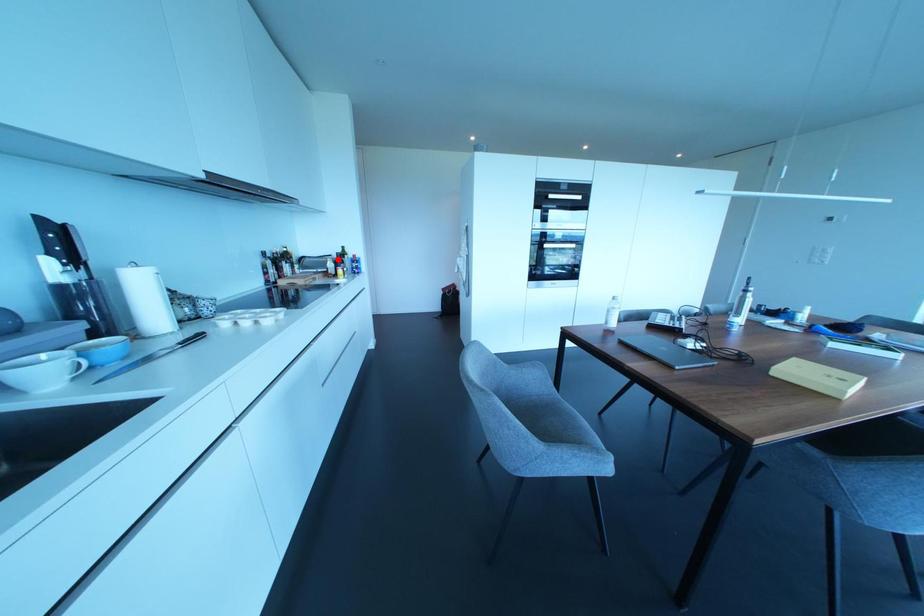
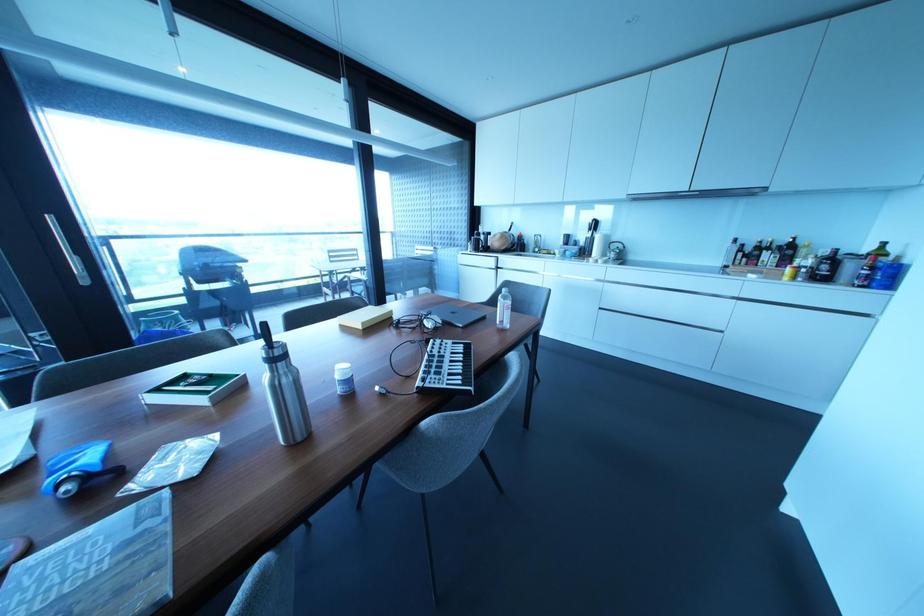
Question: I am providing you with two images of the same scene from different viewpoints. A red point is shown in image1. For the corresponding object point in image2, is it positioned nearer or farther from the camera?

Choices:
 (A) Nearer
 (B) Farther

Answer: (B)